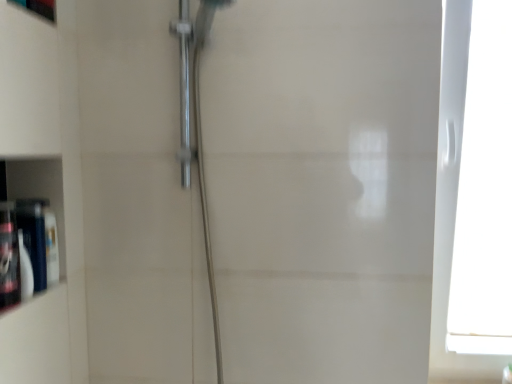
Find the location of a particular element. The width and height of the screenshot is (512, 384). matte black bottle at left, the 1th toiletry when ordered from back to front is located at coordinates (34, 237).

How much space does matte black bottle at left, acting as the 2th toiletry starting from the front, occupy vertically?

8.58 inches.

In order to face matte white cabinet at left, should I rotate leftwards or rightwards?

To face it directly, rotate left by 26.644 degrees.

What do you see at coordinates (484, 192) in the screenshot? I see `white plastic window at right` at bounding box center [484, 192].

Where is `translucent plastic bottle at left, acting as the 1th toiletry starting from the front`? The image size is (512, 384). translucent plastic bottle at left, acting as the 1th toiletry starting from the front is located at coordinates (9, 257).

At what (x,y) coordinates should I click in order to perform the action: click on matte black bottle at left, the 1th toiletry when ordered from back to front. Please return your answer as a coordinate pair (x, y). The width and height of the screenshot is (512, 384). Looking at the image, I should click on (34, 237).

Between translucent plastic bottle at left, the second toiletry viewed from the back, and matte black bottle at left, the 1th toiletry when ordered from back to front, which one has smaller width?

matte black bottle at left, the 1th toiletry when ordered from back to front.

Considering the sizes of objects translucent plastic bottle at left, the second toiletry viewed from the back, and matte black bottle at left, the 1th toiletry when ordered from back to front, in the image provided, who is bigger, translucent plastic bottle at left, the second toiletry viewed from the back, or matte black bottle at left, the 1th toiletry when ordered from back to front,?

Bigger between the two is translucent plastic bottle at left, the second toiletry viewed from the back.

Where is `toiletry below the matte black bottle at left, acting as the 2th toiletry starting from the front (from the image's perspective)`? The width and height of the screenshot is (512, 384). toiletry below the matte black bottle at left, acting as the 2th toiletry starting from the front (from the image's perspective) is located at coordinates (9, 257).

What's the angular difference between white plastic window at right and matte white cabinet at left's facing directions?

The angular difference between white plastic window at right and matte white cabinet at left is 90.3 degrees.

From the image's perspective, is white plastic window at right above matte white cabinet at left?

Yes, from the image's perspective, white plastic window at right is on top of matte white cabinet at left.

Considering the relative positions of white plastic window at right and matte white cabinet at left in the image provided, is white plastic window at right to the right of matte white cabinet at left from the viewer's perspective?

A: Correct, you'll find white plastic window at right to the right of matte white cabinet at left.

I want to click on cabinet above the matte black bottle at left, acting as the 2th toiletry starting from the front (from a real-world perspective), so click(x=40, y=190).

How distant is matte black bottle at left, acting as the 2th toiletry starting from the front, from matte white cabinet at left?

A distance of 3.23 inches exists between matte black bottle at left, acting as the 2th toiletry starting from the front, and matte white cabinet at left.

Does matte black bottle at left, the 1th toiletry when ordered from back to front, have a greater width compared to matte white cabinet at left?

No, matte black bottle at left, the 1th toiletry when ordered from back to front, is not wider than matte white cabinet at left.

Which object is more forward, matte black bottle at left, the 1th toiletry when ordered from back to front, or matte white cabinet at left?

matte black bottle at left, the 1th toiletry when ordered from back to front, is in front.

From the image's perspective, is white plastic window at right located above translucent plastic bottle at left, the second toiletry viewed from the back?

Yes.

Is white plastic window at right taller than translucent plastic bottle at left, acting as the 1th toiletry starting from the front?

Yes, white plastic window at right is taller than translucent plastic bottle at left, acting as the 1th toiletry starting from the front.

Is white plastic window at right oriented towards translucent plastic bottle at left, acting as the 1th toiletry starting from the front?

No, white plastic window at right does not turn towards translucent plastic bottle at left, acting as the 1th toiletry starting from the front.

Based on their positions, is white plastic window at right located to the left or right of translucent plastic bottle at left, the second toiletry viewed from the back?

Based on their positions, white plastic window at right is located to the right of translucent plastic bottle at left, the second toiletry viewed from the back.

Consider the image. From a real-world perspective, is white plastic window at right positioned above or below matte black bottle at left, acting as the 2th toiletry starting from the front?

white plastic window at right is situated higher than matte black bottle at left, acting as the 2th toiletry starting from the front, in the real world.

Is white plastic window at right not close to matte black bottle at left, acting as the 2th toiletry starting from the front?

Yes, white plastic window at right and matte black bottle at left, acting as the 2th toiletry starting from the front, are located far from each other.

From the image's perspective, between white plastic window at right and matte black bottle at left, acting as the 2th toiletry starting from the front, which one is located above?

white plastic window at right is shown above in the image.

Is matte white cabinet at left positioned far away from translucent plastic bottle at left, the second toiletry viewed from the back?

No, there isn't a large distance between matte white cabinet at left and translucent plastic bottle at left, the second toiletry viewed from the back.

From a real-world perspective, who is located higher, matte white cabinet at left or translucent plastic bottle at left, the second toiletry viewed from the back?

matte white cabinet at left, from a real-world perspective.

Does matte white cabinet at left have a greater width compared to translucent plastic bottle at left, the second toiletry viewed from the back?

Yes, matte white cabinet at left is wider than translucent plastic bottle at left, the second toiletry viewed from the back.

Could you measure the distance between matte white cabinet at left and translucent plastic bottle at left, the second toiletry viewed from the back?

matte white cabinet at left and translucent plastic bottle at left, the second toiletry viewed from the back, are 6.54 inches apart from each other.

Can you tell me how much matte white cabinet at left and white plastic window at right differ in facing direction?

The facing directions of matte white cabinet at left and white plastic window at right are 90.3 degrees apart.

Is the surface of matte white cabinet at left in direct contact with white plastic window at right?

No, matte white cabinet at left is not in contact with white plastic window at right.

Does matte white cabinet at left turn towards white plastic window at right?

No, matte white cabinet at left is not turned towards white plastic window at right.

Is matte white cabinet at left further to camera compared to white plastic window at right?

Yes, it is behind white plastic window at right.

Identify the location of toiletry that appears in front of the matte black bottle at left, acting as the 2th toiletry starting from the front. The image size is (512, 384). (9, 257).

Where is `window located on the right of matte white cabinet at left`? Image resolution: width=512 pixels, height=384 pixels. window located on the right of matte white cabinet at left is located at coordinates (484, 192).

Estimate the real-world distances between objects in this image. Which object is further from white plastic window at right, matte white cabinet at left or translucent plastic bottle at left, the second toiletry viewed from the back?

translucent plastic bottle at left, the second toiletry viewed from the back.

When comparing their distances from white plastic window at right, does matte black bottle at left, acting as the 2th toiletry starting from the front, or translucent plastic bottle at left, the second toiletry viewed from the back, seem closer?

matte black bottle at left, acting as the 2th toiletry starting from the front, lies closer to white plastic window at right than the other object.

Which object lies nearer to the anchor point matte white cabinet at left, white plastic window at right or matte black bottle at left, the 1th toiletry when ordered from back to front?

matte black bottle at left, the 1th toiletry when ordered from back to front, lies closer to matte white cabinet at left than the other object.

Based on their spatial positions, is matte white cabinet at left or translucent plastic bottle at left, the second toiletry viewed from the back, closer to matte black bottle at left, the 1th toiletry when ordered from back to front?

The object closer to matte black bottle at left, the 1th toiletry when ordered from back to front, is translucent plastic bottle at left, the second toiletry viewed from the back.

From the picture: When comparing their distances from translucent plastic bottle at left, acting as the 1th toiletry starting from the front, does white plastic window at right or matte black bottle at left, the 1th toiletry when ordered from back to front, seem closer?

matte black bottle at left, the 1th toiletry when ordered from back to front, is closer to translucent plastic bottle at left, acting as the 1th toiletry starting from the front.

From the image, which object appears to be farther from matte white cabinet at left, white plastic window at right or translucent plastic bottle at left, acting as the 1th toiletry starting from the front?

Among the two, white plastic window at right is located further to matte white cabinet at left.

Considering their positions, is matte white cabinet at left positioned further to translucent plastic bottle at left, acting as the 1th toiletry starting from the front, than matte black bottle at left, the 1th toiletry when ordered from back to front?

matte white cabinet at left is further to translucent plastic bottle at left, acting as the 1th toiletry starting from the front.

From the image, which object appears to be nearer to translucent plastic bottle at left, acting as the 1th toiletry starting from the front, white plastic window at right or matte white cabinet at left?

matte white cabinet at left is closer to translucent plastic bottle at left, acting as the 1th toiletry starting from the front.

The width and height of the screenshot is (512, 384). Identify the location of toiletry between translucent plastic bottle at left, the second toiletry viewed from the back, and white plastic window at right, in the horizontal direction. (34, 237).

I want to click on toiletry between translucent plastic bottle at left, acting as the 1th toiletry starting from the front, and matte white cabinet at left from front to back, so click(x=34, y=237).